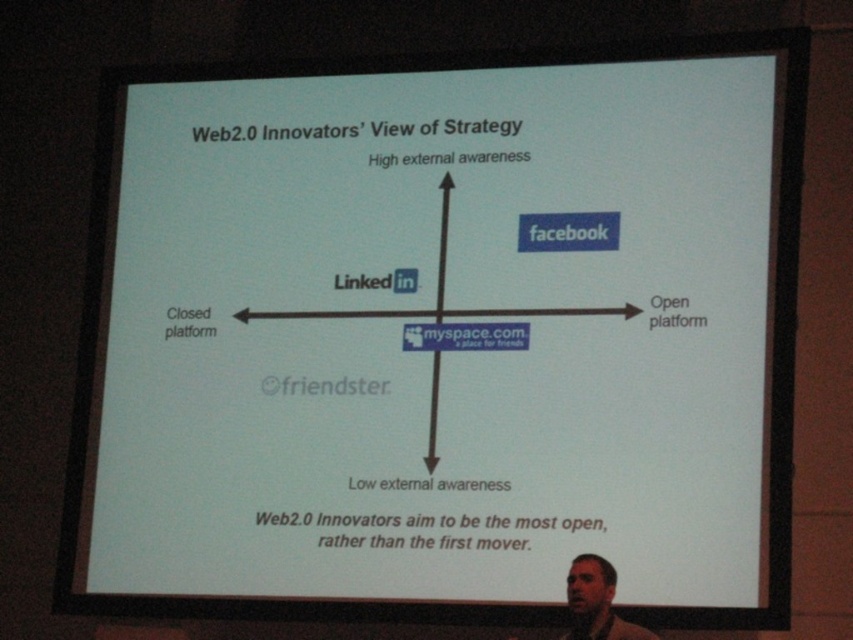
Between point (583, 600) and point (399, 316), which one is positioned in front?

Point (583, 600) is in front.

Which is behind, point (590, 584) or point (380, 308)?

The point (380, 308) is behind.

The width and height of the screenshot is (853, 640). Find the location of `light brown skin at lower right`. light brown skin at lower right is located at coordinates (596, 602).